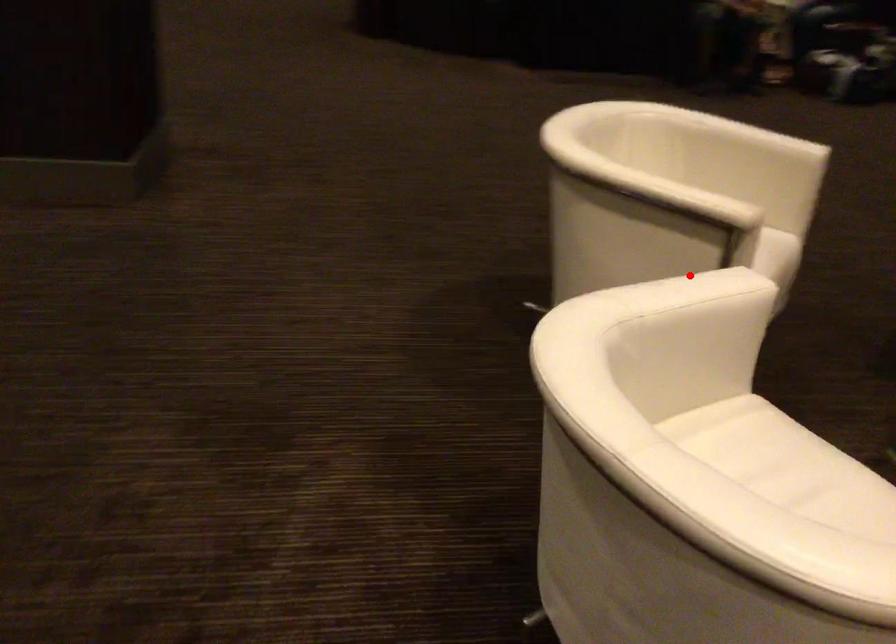
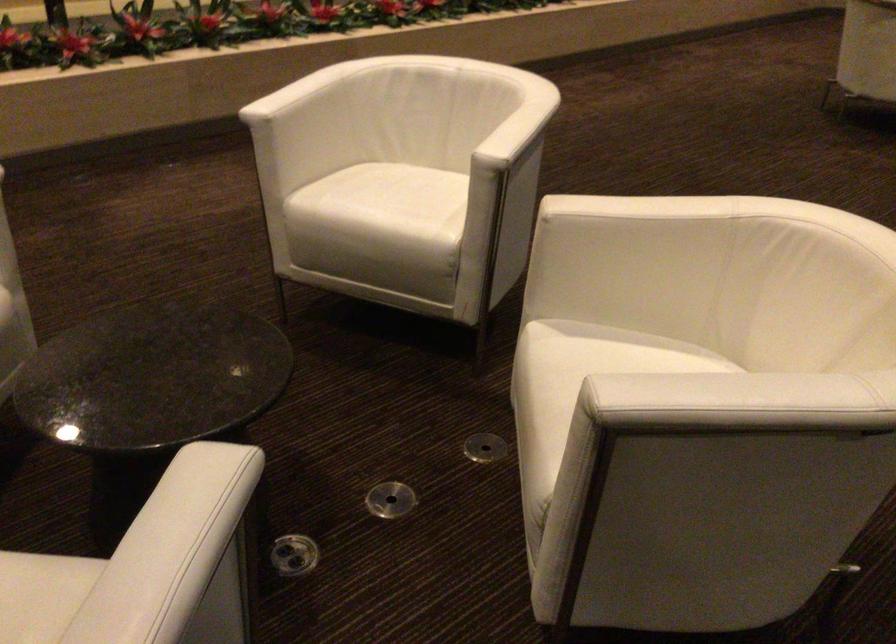
In the second image, find the point that corresponds to the highlighted location in the first image.

(515, 122)